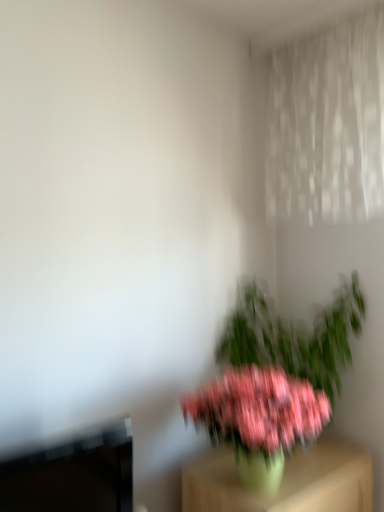
You are a GUI agent. You are given a task and a screenshot of the screen. Output one action in this format:
    pyautogui.click(x=<x>, y=<y>)
    Task: Click on the free point below pink matte flower at center (from a real-world perspective)
    The height and width of the screenshot is (512, 384).
    Given the screenshot: What is the action you would take?
    pyautogui.click(x=261, y=490)